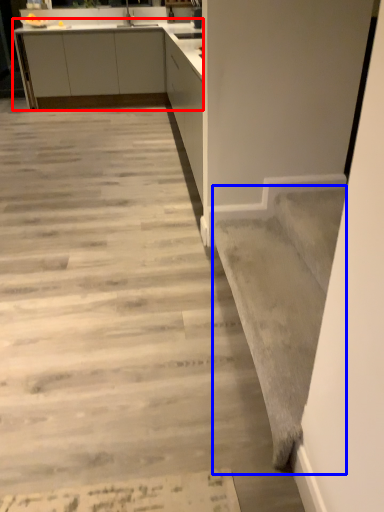
Question: Among these objects, which one is nearest to the camera, cabinetry (highlighted by a red box) or stairwell (highlighted by a blue box)?

Choices:
 (A) cabinetry
 (B) stairwell

Answer: (B)